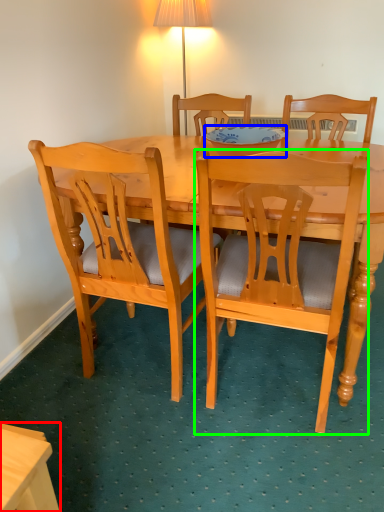
Question: Which is nearer to the desk (highlighted by a red box)? bowl (highlighted by a blue box) or chair (highlighted by a green box).

Choices:
 (A) bowl
 (B) chair

Answer: (B)